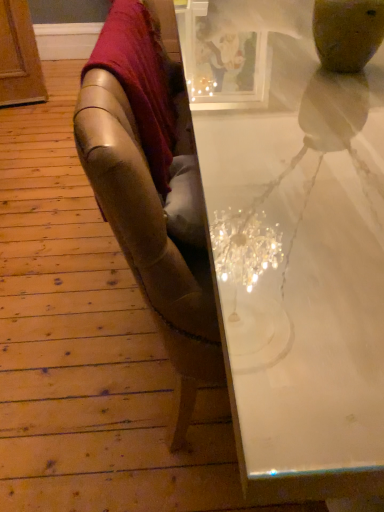
Question: Is white glossy table at upper right bigger or smaller than velvet red blanket at upper left?

Choices:
 (A) small
 (B) big

Answer: (B)

Question: Which is correct: white glossy table at upper right is inside velvet red blanket at upper left, or outside of it?

Choices:
 (A) inside
 (B) outside

Answer: (B)

Question: Relative to velvet red blanket at upper left, is white glossy table at upper right in front or behind?

Choices:
 (A) behind
 (B) front

Answer: (B)

Question: Is velvet red blanket at upper left in front of or behind white glossy table at upper right in the image?

Choices:
 (A) behind
 (B) front

Answer: (A)

Question: Is velvet red blanket at upper left inside or outside of white glossy table at upper right?

Choices:
 (A) inside
 (B) outside

Answer: (B)

Question: Is point coord(142,9) closer or farther from the camera than point coord(309,378)?

Choices:
 (A) closer
 (B) farther

Answer: (B)

Question: Looking at their shapes, would you say velvet red blanket at upper left is wider or thinner than white glossy table at upper right?

Choices:
 (A) wide
 (B) thin

Answer: (B)